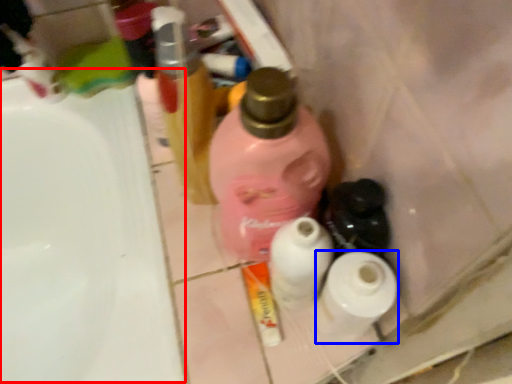
Question: Which point is further to the camera, sink (highlighted by a red box) or toilet paper (highlighted by a blue box)?

Choices:
 (A) sink
 (B) toilet paper

Answer: (A)